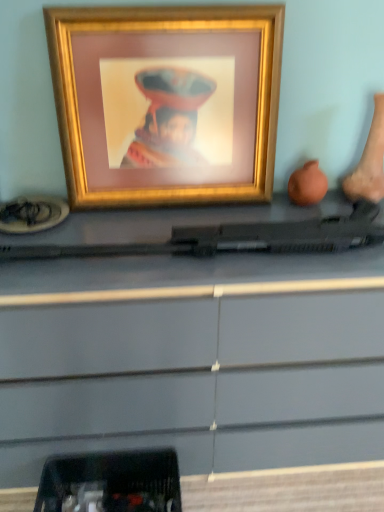
Question: Do you think matte black gun at center is within gold metallic picture frame at upper center, or outside of it?

Choices:
 (A) inside
 (B) outside

Answer: (B)

Question: In terms of height, does matte black gun at center look taller or shorter compared to gold metallic picture frame at upper center?

Choices:
 (A) short
 (B) tall

Answer: (B)

Question: Which object is the farthest from the matte black gun at center?

Choices:
 (A) black plastic tray at lower left
 (B) gold metallic picture frame at upper center

Answer: (B)

Question: Which object is the closest to the black plastic tray at lower left?

Choices:
 (A) gold metallic picture frame at upper center
 (B) matte black gun at center

Answer: (B)